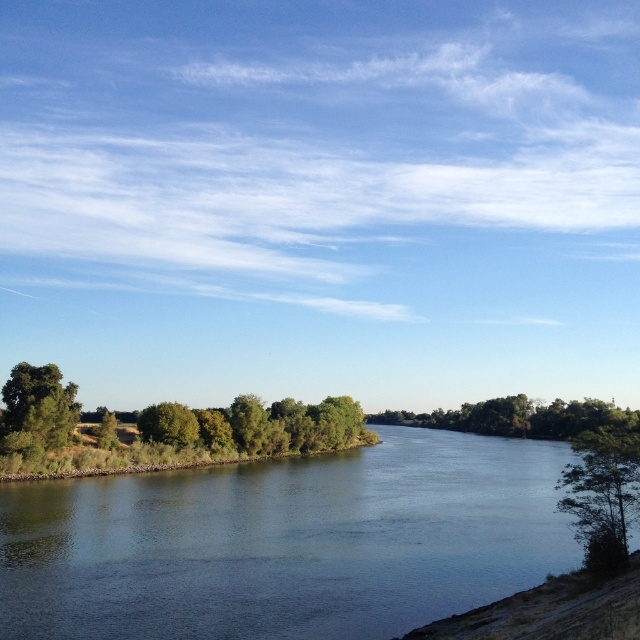
You are standing at the riverside and want to take a photo of the dark blue water at center and the green leafy tree at lower left. Which object should you focus on first to ensure both are in sharp focus?

You should focus on the green leafy tree at lower left first because it is closer to you than the dark blue water at center, which is further away. This way, both objects will be in focus as the tree is nearer and the water is behind it.

You are standing at the point with coordinates point (x=609, y=440) and want to walk to the point with coordinates point (x=163, y=536). Based on the scene description, will you have to walk towards the river or away from it?

Based on the scene description, point (x=163, y=536) is behind point (x=609, y=440). Since the river is in the center of the frame stretching horizontally, moving from point (x=609, y=440) to point (x=163, y=536) would require walking towards the river as the destination point is closer to the riverbank.